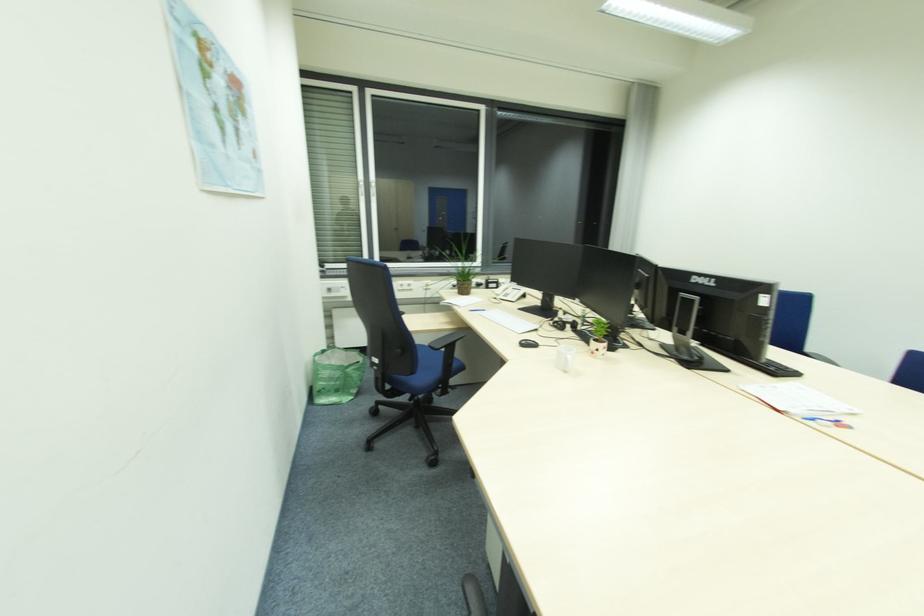
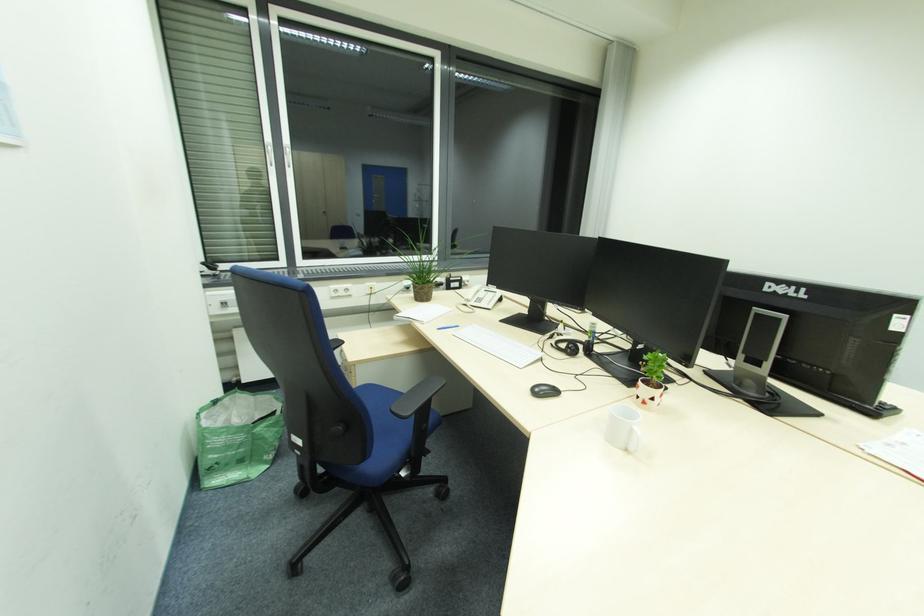
Question: Based on the continuous images, in which direction is the camera rotating? Reply with the corresponding letter.

Choices:
 (A) Left
 (B) Right
 (C) Up
 (D) Down

Answer: (B)